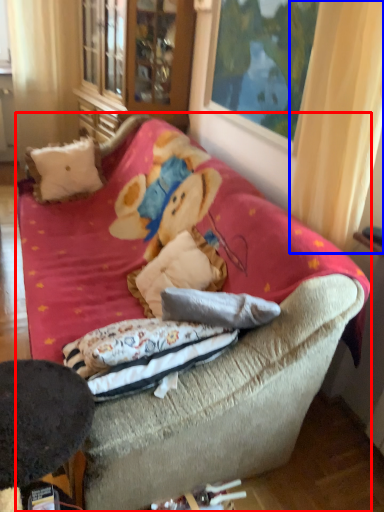
Question: Which of the following is the farthest to the observer, studio couch (highlighted by a red box) or curtain (highlighted by a blue box)?

Choices:
 (A) studio couch
 (B) curtain

Answer: (B)